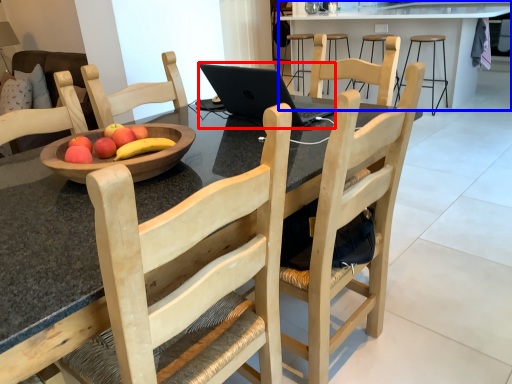
Question: Which object is further to the camera taking this photo, laptop (highlighted by a red box) or table (highlighted by a blue box)?

Choices:
 (A) laptop
 (B) table

Answer: (B)